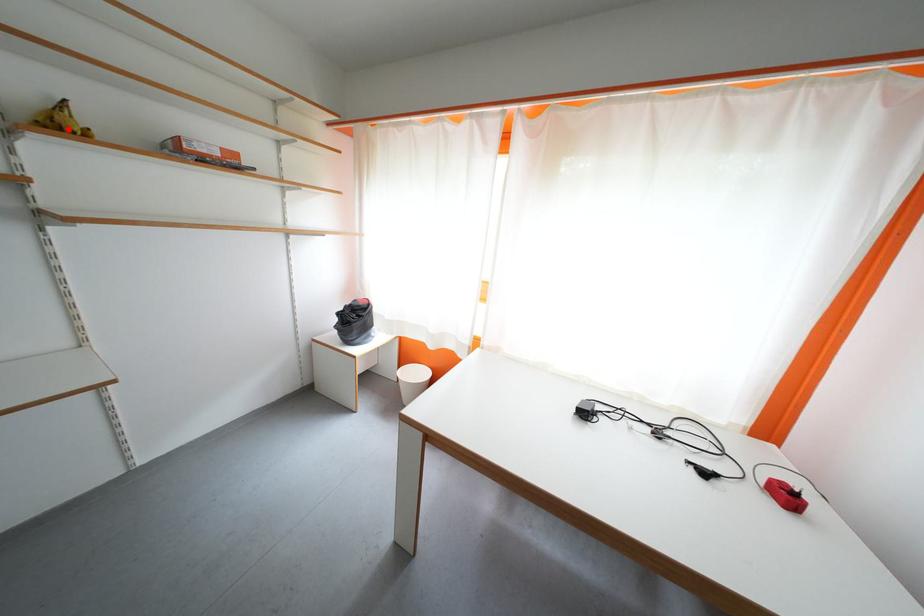
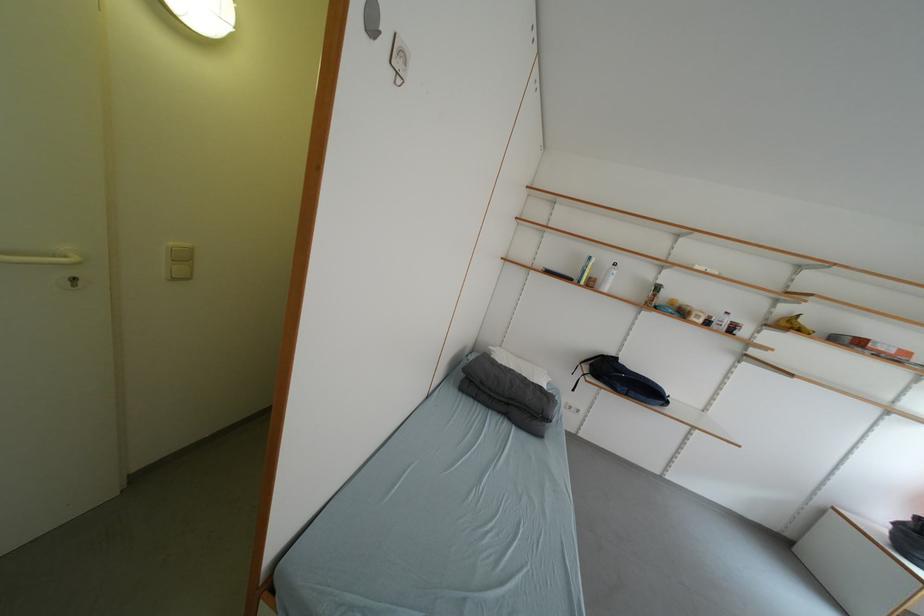
Question: I am providing you with two images of the same scene from different viewpoints. A red point is marked on the first image. At the location where the point appears in image 1, is it still visible in image 2?

Choices:
 (A) Yes
 (B) No

Answer: (A)